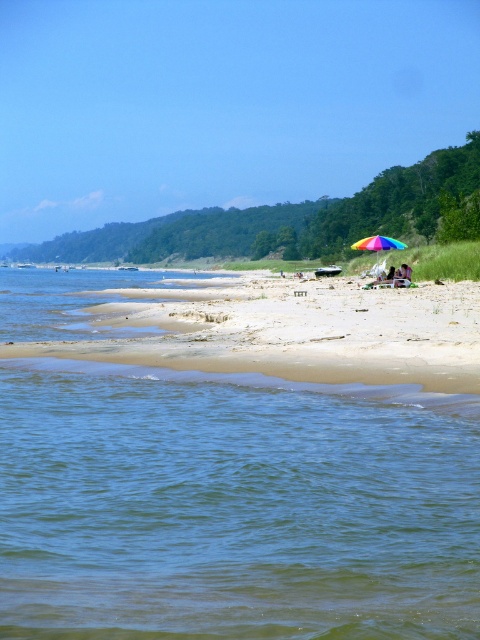
Between point (166, 564) and point (468, 348), which one is positioned in front?

Point (166, 564) is more forward.

In the scene shown: Is clear blue water at lower left bigger than sandy beach at center?

No.

What do you see at coordinates (232, 506) in the screenshot? The height and width of the screenshot is (640, 480). I see `clear blue water at lower left` at bounding box center [232, 506].

Where is `clear blue water at lower left`? clear blue water at lower left is located at coordinates (232, 506).

Does clear blue water at lower left have a greater width compared to rainbow fabric umbrella at center?

Yes.

Locate an element on the screen. clear blue water at lower left is located at coordinates (232, 506).

Locate an element on the screen. sandy beach at center is located at coordinates (287, 330).

Does point (446, 332) lie behind point (373, 243)?

No, (446, 332) is in front of (373, 243).

Does point (176, 317) lie in front of point (352, 244)?

Yes, point (176, 317) is closer to viewer.

Identify the location of sandy beach at center. (287, 330).